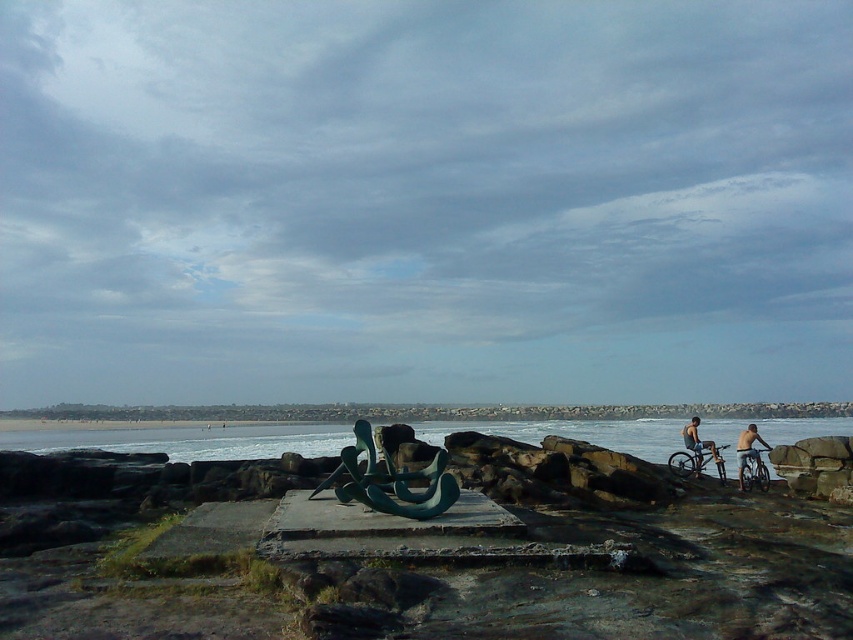
Question: Is metallic silver bicycles at right thinner than silver metallic bicycle at right?

Choices:
 (A) yes
 (B) no

Answer: (B)

Question: Estimate the real-world distances between objects in this image. Which object is farther from the silver metallic bicycle at right?

Choices:
 (A) skinny man on bicycle at right
 (B) metallic silver bicycles at right
 (C) shiny metallic bicycle at right
 (D) blue water at lower left

Answer: (D)

Question: Which point is closer to the camera?

Choices:
 (A) silver metallic bicycle at right
 (B) skinny man on bicycle at right
 (C) metallic silver bicycles at right
 (D) blue water at lower left

Answer: (C)

Question: Estimate the real-world distances between objects in this image. Which object is closer to the skinny man on bicycle at right?

Choices:
 (A) silver metallic bicycle at right
 (B) shiny metallic bicycle at right

Answer: (A)

Question: Considering the relative positions of blue water at lower left and shiny metallic bicycle at right in the image provided, where is blue water at lower left located with respect to shiny metallic bicycle at right?

Choices:
 (A) above
 (B) below

Answer: (B)

Question: Does blue water at lower left have a larger size compared to silver metallic bicycle at right?

Choices:
 (A) yes
 (B) no

Answer: (A)